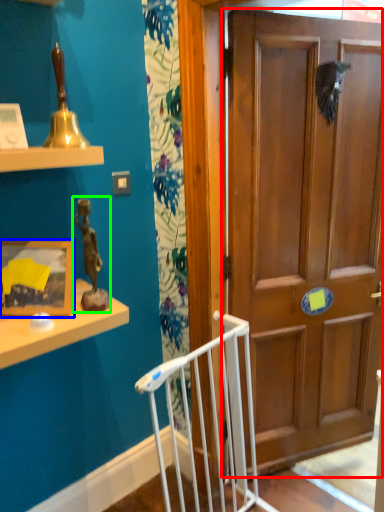
Question: Based on their relative distances, which object is nearer to door (highlighted by a red box)? Choose from picture frame (highlighted by a blue box) and toy (highlighted by a green box).

Choices:
 (A) picture frame
 (B) toy

Answer: (B)